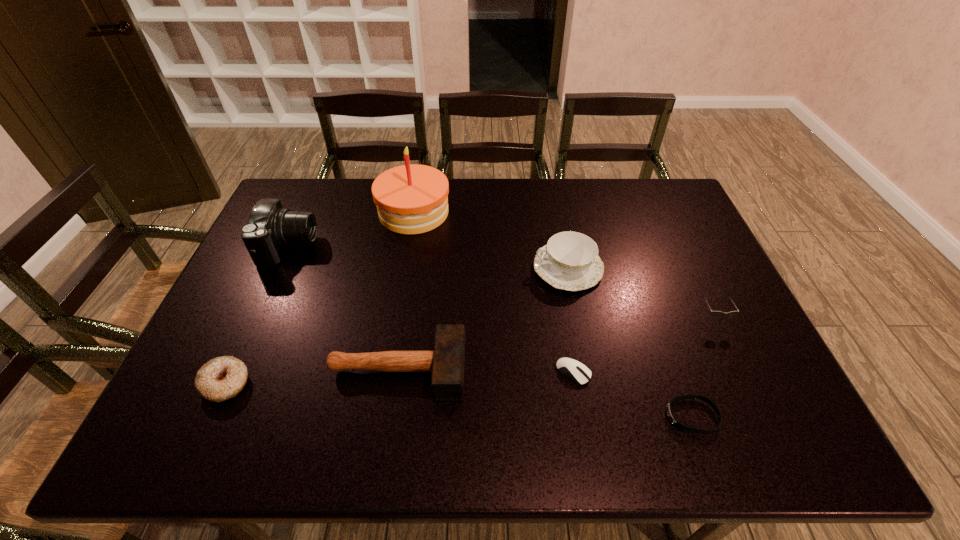
Image resolution: width=960 pixels, height=540 pixels. What are the coordinates of `vacant area between the birthday cake and the chinaware` in the screenshot? It's located at (491, 240).

Where is `free space between the mallet and the chinaware`? Image resolution: width=960 pixels, height=540 pixels. free space between the mallet and the chinaware is located at coordinates (483, 319).

Locate which object ranks sixth in proximity to the camera. Please provide its 2D coordinates. Your answer should be formatted as a tuple, i.e. [(x, y)], where the tuple contains the x and y coordinates of a point satisfying the conditions above.

[(670, 414)]

The height and width of the screenshot is (540, 960). I want to click on object identified as the sixth closest to the chinaware, so click(269, 227).

At what (x,y) coordinates should I click in order to perform the action: click on blank area in the image that satisfies the following two spatial constraints: 1. in front of the lenses of the rightmost object; 2. on the hammer head face of the mallet. Please return your answer as a coordinate pair (x, y). The image size is (960, 540). Looking at the image, I should click on (736, 369).

This screenshot has height=540, width=960. In order to click on blank space that satisfies the following two spatial constraints: 1. on the back side of the doughnut; 2. on the left side of the mouse in this screenshot , I will do `click(230, 373)`.